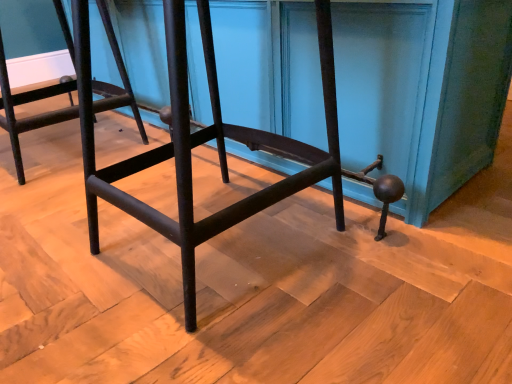
The width and height of the screenshot is (512, 384). In order to click on free space to the left of matte black stool at center in this screenshot , I will do `click(59, 246)`.